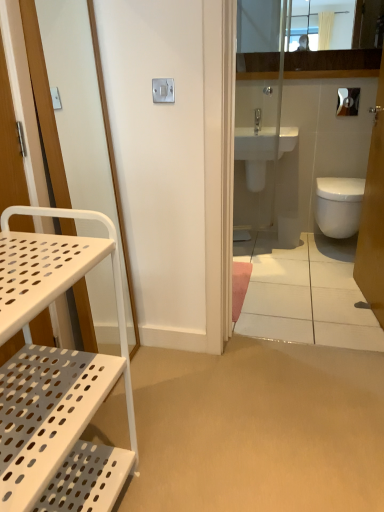
What do you see at coordinates (56, 376) in the screenshot? The image size is (384, 512). I see `white perforated metal cart at left` at bounding box center [56, 376].

Where is `white glossy toilet paper at upper right`? The width and height of the screenshot is (384, 512). white glossy toilet paper at upper right is located at coordinates (348, 101).

Describe the element at coordinates (44, 103) in the screenshot. I see `white perforated shelf at left, which is the first screen door from left to right` at that location.

I want to click on white glossy toilet at right, so click(321, 130).

Looking at this image, which object is positioned more to the right, white glossy toilet paper at upper right or white matte bidet at center, which appears as the second bidet when viewed from the right?

Positioned to the right is white glossy toilet paper at upper right.

From the white glossy toilet paper at upper right, count the 2nd bidet to the left and point to it. Please provide its 2D coordinates.

[(255, 175)]

Would you say white glossy toilet paper at upper right is inside or outside white matte bidet at center, which ranks as the first bidet in left-to-right order?

white glossy toilet paper at upper right exists outside the volume of white matte bidet at center, which ranks as the first bidet in left-to-right order.

Is white matte bidet at center, which ranks as the first bidet in left-to-right order, at the back of white glossy toilet paper at upper right?

No.

Who is taller, silver metallic lock at upper center or white perforated shelf at left, the second screen door when ordered from right to left?

white perforated shelf at left, the second screen door when ordered from right to left, is taller.

Does point (165, 80) appear closer or farther from the camera than point (34, 9)?

Point (165, 80) appears to be farther away from the viewer than point (34, 9).

Between silver metallic lock at upper center and white perforated shelf at left, the second screen door when ordered from right to left, which one has larger size?

With larger size is white perforated shelf at left, the second screen door when ordered from right to left.

Considering the positions of objects silver metallic lock at upper center and white perforated shelf at left, which is the first screen door from left to right, in the image provided, who is more to the right, silver metallic lock at upper center or white perforated shelf at left, which is the first screen door from left to right,?

silver metallic lock at upper center is more to the right.

From the image's perspective, who appears lower, white perforated metal cart at left or white glossy toilet at right?

white perforated metal cart at left.

Is white perforated metal cart at left oriented towards white glossy toilet at right?

No, white perforated metal cart at left is not turned towards white glossy toilet at right.

Is white perforated metal cart at left next to white glossy toilet at right and touching it?

No, white perforated metal cart at left is not with white glossy toilet at right.

Consider the image. Is white perforated metal cart at left wider or thinner than white glossy toilet at right?

white perforated metal cart at left is wider than white glossy toilet at right.

Are white glossy toilet paper at upper right and white perforated shelf at left, the second screen door when ordered from right to left, far apart?

Indeed, white glossy toilet paper at upper right is not near white perforated shelf at left, the second screen door when ordered from right to left.

Considering their positions, is white glossy toilet paper at upper right located in front of or behind white perforated shelf at left, the second screen door when ordered from right to left?

white glossy toilet paper at upper right is behind white perforated shelf at left, the second screen door when ordered from right to left.

What's the angular difference between white glossy toilet paper at upper right and white perforated shelf at left, which is the first screen door from left to right,'s facing directions?

The angular difference between white glossy toilet paper at upper right and white perforated shelf at left, which is the first screen door from left to right, is 90 degrees.

Between white glossy toilet paper at upper right and white perforated shelf at left, the second screen door when ordered from right to left, which one has smaller size?

white glossy toilet paper at upper right.

This screenshot has height=512, width=384. There is a white perforated shelf at left, which is the first screen door from left to right. Identify the location of the 2nd bidet above it (from the image's perspective). coord(255,175).

Based on the photo, is white matte bidet at center, which ranks as the first bidet in left-to-right order, behind white perforated shelf at left, which is the first screen door from left to right?

That is True.

From the image's perspective, which is below, white matte bidet at center, which appears as the second bidet when viewed from the right, or white perforated shelf at left, which is the first screen door from left to right?

white perforated shelf at left, which is the first screen door from left to right, appears lower in the image.

Between white matte bidet at center, which ranks as the first bidet in left-to-right order, and white perforated shelf at left, which is the first screen door from left to right, which one has less height?

white matte bidet at center, which ranks as the first bidet in left-to-right order, is shorter.

Which is more to the right, white glossy toilet paper at upper right or white perforated metal cart at left?

From the viewer's perspective, white glossy toilet paper at upper right appears more on the right side.

At what (x,y) coordinates should I click in order to perform the action: click on toilet paper behind the white perforated metal cart at left. Please return your answer as a coordinate pair (x, y). Looking at the image, I should click on (348, 101).

Between white glossy toilet paper at upper right and white perforated metal cart at left, which one has smaller size?

With smaller size is white glossy toilet paper at upper right.

Based on the photo, from the image's perspective, between white glossy toilet paper at upper right and white perforated metal cart at left, which one is located above?

From the image's view, white glossy toilet paper at upper right is above.

Which is nearer, (272, 124) or (334, 30)?

The point (272, 124) is in front.

Identify the location of mirror located behind the white glossy toilet at right. (339, 21).

Is white glossy toilet at right situated inside glossy wooden mirror at upper center or outside?

white glossy toilet at right lies outside glossy wooden mirror at upper center.

Is white glossy toilet at right bigger than glossy wooden mirror at upper center?

Yes.

You are a GUI agent. You are given a task and a screenshot of the screen. Output one action in this format:
    pyautogui.click(x=<x>, y=<y>)
    Task: Click on the 1st bidet directly beneath the white glossy toilet paper at upper right (from a real-world perspective)
    This screenshot has height=512, width=384.
    Given the screenshot: What is the action you would take?
    pyautogui.click(x=255, y=175)

This screenshot has height=512, width=384. Find the location of `screen door that is the 2nd object located in front of the silver metallic lock at upper center`. screen door that is the 2nd object located in front of the silver metallic lock at upper center is located at coordinates (44, 103).

Estimate the real-world distances between objects in this image. Which object is closer to white perforated metal cart at left, silver metallic lock at upper center or white glossy screen door at upper right, arranged as the 2th screen door when viewed from the left?

silver metallic lock at upper center.

Considering their positions, is white matte bidet at center, which appears as the second bidet when viewed from the right, positioned closer to white glossy bidet at right, which is the 1th bidet in right-to-left order, than white glossy toilet paper at upper right?

white matte bidet at center, which appears as the second bidet when viewed from the right.

Looking at the image, which one is located closer to white perforated metal cart at left, white glossy toilet at right or white matte bidet at center, which ranks as the first bidet in left-to-right order?

Based on the image, white matte bidet at center, which ranks as the first bidet in left-to-right order, appears to be nearer to white perforated metal cart at left.

Considering their positions, is white glossy toilet at right positioned closer to glossy wooden mirror at upper center than white glossy toilet paper at upper right?

white glossy toilet at right is positioned closer to the anchor glossy wooden mirror at upper center.

Estimate the real-world distances between objects in this image. Which object is further from white perforated shelf at left, which is the first screen door from left to right, white glossy bidet at right, which is the 1th bidet in right-to-left order, or white glossy toilet paper at upper right?

white glossy toilet paper at upper right is further to white perforated shelf at left, which is the first screen door from left to right.

Based on their spatial positions, is white glossy toilet paper at upper right or silver metallic lock at upper center closer to white matte bidet at center, which ranks as the first bidet in left-to-right order?

Among the two, white glossy toilet paper at upper right is located nearer to white matte bidet at center, which ranks as the first bidet in left-to-right order.

Which object lies nearer to the anchor point white perforated shelf at left, the second screen door when ordered from right to left, glossy wooden mirror at upper center or white perforated metal cart at left?

white perforated metal cart at left is positioned closer to the anchor white perforated shelf at left, the second screen door when ordered from right to left.

Based on their spatial positions, is white perforated metal cart at left or white matte bidet at center, which ranks as the first bidet in left-to-right order, further from white glossy bidet at right, the second bidet viewed from the left?

Based on the image, white perforated metal cart at left appears to be further to white glossy bidet at right, the second bidet viewed from the left.

I want to click on bidet between white perforated shelf at left, which is the first screen door from left to right, and glossy wooden mirror at upper center from front to back, so click(338, 205).

This screenshot has height=512, width=384. I want to click on lock between white perforated shelf at left, which is the first screen door from left to right, and white glossy toilet paper at upper right in the front-back direction, so click(x=163, y=90).

Identify the location of screen door between white glossy toilet at right and white glossy bidet at right, which is the 1th bidet in right-to-left order, along the z-axis. (373, 215).

Locate an element on the screen. This screenshot has height=512, width=384. screen door positioned between white glossy toilet at right and white matte bidet at center, which ranks as the first bidet in left-to-right order, from near to far is located at coordinates (373, 215).